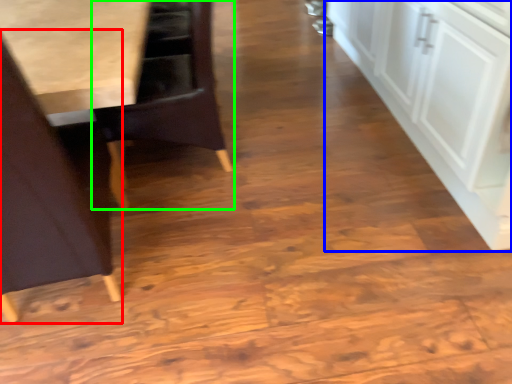
Question: Which object is the closest to the chair (highlighted by a red box)? Choose among these: cabinetry (highlighted by a blue box) or chair (highlighted by a green box).

Choices:
 (A) cabinetry
 (B) chair

Answer: (B)